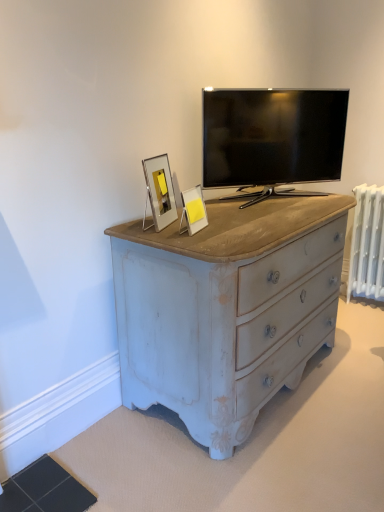
Question: Is matte white picture frame at center, which appears as the second picture frame when viewed from the left, in contact with white painted metal radiator at right?

Choices:
 (A) yes
 (B) no

Answer: (B)

Question: Is matte white picture frame at center, the first picture frame when ordered from right to left, to the right of white painted metal radiator at right from the viewer's perspective?

Choices:
 (A) yes
 (B) no

Answer: (B)

Question: Is matte white picture frame at center, the first picture frame when ordered from right to left, closer to the viewer compared to white painted metal radiator at right?

Choices:
 (A) yes
 (B) no

Answer: (A)

Question: Considering the relative sizes of matte white picture frame at center, the first picture frame when ordered from right to left, and white painted metal radiator at right in the image provided, is matte white picture frame at center, the first picture frame when ordered from right to left, bigger than white painted metal radiator at right?

Choices:
 (A) no
 (B) yes

Answer: (A)

Question: From a real-world perspective, does matte white picture frame at center, which appears as the second picture frame when viewed from the left, sit lower than white painted metal radiator at right?

Choices:
 (A) no
 (B) yes

Answer: (A)

Question: Based on their sizes in the image, would you say white painted metal radiator at right is bigger or smaller than matte white picture frame at center, which appears as the second picture frame when viewed from the left?

Choices:
 (A) big
 (B) small

Answer: (A)

Question: Considering their positions, is white painted metal radiator at right located in front of or behind matte white picture frame at center, the first picture frame when ordered from right to left?

Choices:
 (A) behind
 (B) front

Answer: (A)

Question: Which is correct: white painted metal radiator at right is inside matte white picture frame at center, which appears as the second picture frame when viewed from the left, or outside of it?

Choices:
 (A) outside
 (B) inside

Answer: (A)

Question: From the image's perspective, is white painted metal radiator at right above or below matte white picture frame at center, the first picture frame when ordered from right to left?

Choices:
 (A) below
 (B) above

Answer: (A)

Question: From a real-world perspective, is black glossy tv at upper center positioned above or below silver metallic picture frame at upper center, the second picture frame from the right?

Choices:
 (A) below
 (B) above

Answer: (B)

Question: Is black glossy tv at upper center situated inside silver metallic picture frame at upper center, which ranks as the 1th picture frame in left-to-right order, or outside?

Choices:
 (A) outside
 (B) inside

Answer: (A)

Question: Considering the positions of point (329, 96) and point (153, 168), is point (329, 96) closer or farther from the camera than point (153, 168)?

Choices:
 (A) farther
 (B) closer

Answer: (A)

Question: Is black glossy tv at upper center in front of or behind silver metallic picture frame at upper center, which ranks as the 1th picture frame in left-to-right order, in the image?

Choices:
 (A) front
 (B) behind

Answer: (B)

Question: Considering the positions of black glossy tv at upper center and matte white picture frame at center, the first picture frame when ordered from right to left, in the image, is black glossy tv at upper center taller or shorter than matte white picture frame at center, the first picture frame when ordered from right to left,?

Choices:
 (A) short
 (B) tall

Answer: (B)

Question: In terms of width, does black glossy tv at upper center look wider or thinner when compared to matte white picture frame at center, which appears as the second picture frame when viewed from the left?

Choices:
 (A) thin
 (B) wide

Answer: (B)